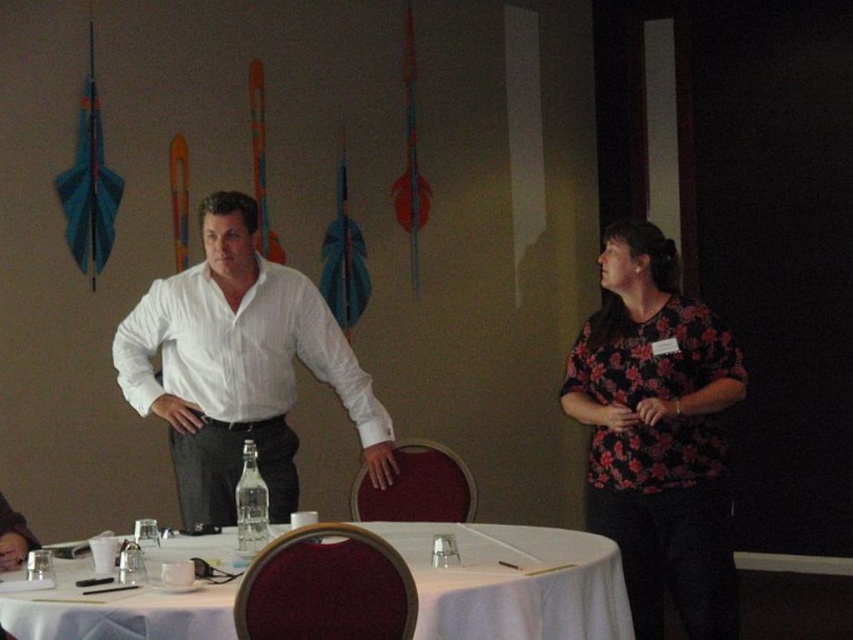
You are standing in the conference room and want to place a new object between the two points labeled point (735, 364) and point (514, 604). Based on their positions, which point is closer to you, the viewer?

Point (735, 364) is closer to the viewer than point (514, 604) because it is further to the viewer according to the description.

Based on the photo, you are organizing a small event and need to place a decorative item that requires 1 meter of space. Given the floral print blouse at center and the white fabric table at center, which object can accommodate the item based on their widths?

The white fabric table at center can accommodate the decorative item since it has a greater width than the floral print blouse at center.

You are standing in the conference room and need to place a document on the table. Which object, the floral print blouse at center or the white fabric table at center, is the correct surface to place the document?

The white fabric table at center is the correct surface to place the document because the floral print blouse at center is closer to you but it is clothing, not a table. The white fabric table at center is further away but is the actual table surface.